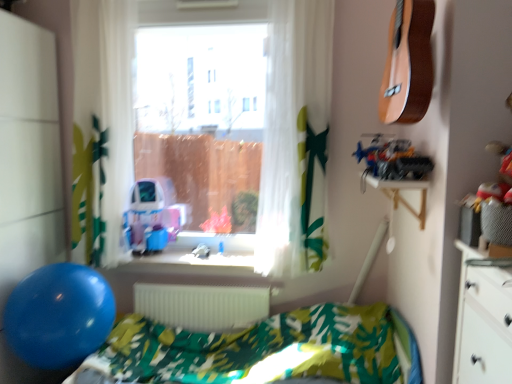
Measure the distance between white matte radiator at center and camera.

They are 2.76 meters apart.

Image resolution: width=512 pixels, height=384 pixels. Identify the location of metallic silver toy car at upper right. (392, 159).

Find the location of a particular element. The image size is (512, 384). white matte radiator at center is located at coordinates (202, 305).

Consider the image. Who is taller, green leaf-patterned fabric hospital bed at lower center or blue rubber balloon at lower left?

A: With more height is green leaf-patterned fabric hospital bed at lower center.

From a real-world perspective, is green leaf-patterned fabric hospital bed at lower center on top of blue rubber balloon at lower left?

Actually, green leaf-patterned fabric hospital bed at lower center is physically below blue rubber balloon at lower left in the real world.

Consider the image. Is green leaf-patterned fabric hospital bed at lower center directly adjacent to blue rubber balloon at lower left?

No, green leaf-patterned fabric hospital bed at lower center is not in contact with blue rubber balloon at lower left.

Looking at the image, does green leaf-patterned fabric hospital bed at lower center seem bigger or smaller compared to blue rubber balloon at lower left?

In the image, green leaf-patterned fabric hospital bed at lower center appears to be larger than blue rubber balloon at lower left.

From a real-world perspective, count 2nd curtains downward from the light brown wood guitar at upper right and point to it. Please provide its 2D coordinates.

[(295, 139)]

From the image's perspective, relative to light brown wood guitar at upper right, is translucent white curtain at center, the first curtain when ordered from right to left, above or below?

translucent white curtain at center, the first curtain when ordered from right to left, is situated lower than light brown wood guitar at upper right in the image.

Would you consider translucent white curtain at center, which is counted as the 2th curtain, starting from the left, to be distant from light brown wood guitar at upper right?

translucent white curtain at center, which is counted as the 2th curtain, starting from the left, is near light brown wood guitar at upper right, not far away.

Between light brown wood guitar at upper right and transparent glass window at center, which one appears on the left side from the viewer's perspective?

transparent glass window at center.

Based on their sizes in the image, would you say light brown wood guitar at upper right is bigger or smaller than transparent glass window at center?

Considering their sizes, light brown wood guitar at upper right takes up less space than transparent glass window at center.

From a real-world perspective, is light brown wood guitar at upper right below transparent glass window at center?

Actually, light brown wood guitar at upper right is physically above transparent glass window at center in the real world.

From the image's perspective, who appears lower, light brown wood guitar at upper right or transparent glass window at center?

transparent glass window at center is shown below in the image.

From the image's perspective, which object appears higher, light brown wood guitar at upper right or blue rubber balloon at lower left?

light brown wood guitar at upper right, from the image's perspective.

In the scene shown: Considering the relative sizes of light brown wood guitar at upper right and blue rubber balloon at lower left in the image provided, is light brown wood guitar at upper right wider than blue rubber balloon at lower left?

Incorrect, the width of light brown wood guitar at upper right does not surpass that of blue rubber balloon at lower left.

Is light brown wood guitar at upper right oriented towards blue rubber balloon at lower left?

No.

Considering the relative sizes of light brown wood guitar at upper right and blue rubber balloon at lower left in the image provided, is light brown wood guitar at upper right taller than blue rubber balloon at lower left?

In fact, light brown wood guitar at upper right may be shorter than blue rubber balloon at lower left.

Between green leaf-patterned fabric hospital bed at lower center and blue plastic toy at center, which one has less height?

blue plastic toy at center is shorter.

From a real-world perspective, is green leaf-patterned fabric hospital bed at lower center positioned under blue plastic toy at center based on gravity?

Yes.

How far apart are green leaf-patterned fabric hospital bed at lower center and blue plastic toy at center?

A distance of 34.32 inches exists between green leaf-patterned fabric hospital bed at lower center and blue plastic toy at center.

Between wooden shelf at upper right and white/sheer curtain at left, which ranks as the first curtain in left-to-right order, which one has smaller size?

wooden shelf at upper right is smaller.

Can you tell me how much wooden shelf at upper right and white/sheer curtain at left, the second curtain viewed from the right, differ in facing direction?

wooden shelf at upper right and white/sheer curtain at left, the second curtain viewed from the right, are facing 87.3 degrees away from each other.

Consider the image. Considering the sizes of wooden shelf at upper right and white/sheer curtain at left, which ranks as the first curtain in left-to-right order, in the image, is wooden shelf at upper right taller or shorter than white/sheer curtain at left, which ranks as the first curtain in left-to-right order,?

In the image, wooden shelf at upper right appears to be shorter than white/sheer curtain at left, which ranks as the first curtain in left-to-right order.

Is wooden shelf at upper right in contact with white/sheer curtain at left, which ranks as the first curtain in left-to-right order?

No, wooden shelf at upper right is not with white/sheer curtain at left, which ranks as the first curtain in left-to-right order.

From the image's perspective, relative to white matte radiator at center, is translucent white curtain at center, the first curtain when ordered from right to left, above or below?

From the image's perspective, translucent white curtain at center, the first curtain when ordered from right to left, appears above white matte radiator at center.

Is translucent white curtain at center, which is counted as the 2th curtain, starting from the left, at the left side of white matte radiator at center?

No.

Is translucent white curtain at center, the first curtain when ordered from right to left, turned away from white matte radiator at center?

That's not correct — translucent white curtain at center, the first curtain when ordered from right to left, is not looking away from white matte radiator at center.

At what (x,y) coordinates should I click in order to perform the action: click on radiator that is below the translucent white curtain at center, which is counted as the 2th curtain, starting from the left (from the image's perspective). Please return your answer as a coordinate pair (x, y). This screenshot has width=512, height=384. Looking at the image, I should click on (202, 305).

The width and height of the screenshot is (512, 384). In order to click on hospital bed that appears below the blue rubber balloon at lower left (from the image's perspective) in this screenshot , I will do `click(262, 350)`.

The width and height of the screenshot is (512, 384). Find the location of `guitar positioned vertically above the translucent white curtain at center, which is counted as the 2th curtain, starting from the left (from a real-world perspective)`. guitar positioned vertically above the translucent white curtain at center, which is counted as the 2th curtain, starting from the left (from a real-world perspective) is located at coordinates (408, 64).

In the scene shown: Based on their spatial positions, is white/sheer curtain at left, which ranks as the first curtain in left-to-right order, or metallic silver toy car at upper right closer to wooden shelf at upper right?

metallic silver toy car at upper right.

Considering their positions, is wooden shelf at upper right positioned further to blue rubber balloon at lower left than blue plastic toy at center?

Among the two, wooden shelf at upper right is located further to blue rubber balloon at lower left.

Based on their spatial positions, is wooden shelf at upper right or translucent white curtain at center, which is counted as the 2th curtain, starting from the left, closer to blue rubber balloon at lower left?

translucent white curtain at center, which is counted as the 2th curtain, starting from the left.

Looking at the image, which one is located further to green leaf-patterned fabric hospital bed at lower center, white matte radiator at center or translucent white curtain at center, the first curtain when ordered from right to left?

translucent white curtain at center, the first curtain when ordered from right to left.

From the image, which object appears to be farther from green leaf-patterned fabric hospital bed at lower center, blue rubber balloon at lower left or blue plastic toy at center?

Among the two, blue plastic toy at center is located further to green leaf-patterned fabric hospital bed at lower center.

Looking at this image, when comparing their distances from white matte radiator at center, does blue rubber balloon at lower left or blue plastic toy at center seem closer?

blue plastic toy at center lies closer to white matte radiator at center than the other object.

When comparing their distances from translucent white curtain at center, which is counted as the 2th curtain, starting from the left, does light brown wood guitar at upper right or blue rubber balloon at lower left seem further?

blue rubber balloon at lower left lies further to translucent white curtain at center, which is counted as the 2th curtain, starting from the left, than the other object.

Looking at the image, which one is located further to white matte radiator at center, blue plastic toy at center or translucent white curtain at center, the first curtain when ordered from right to left?

Among the two, translucent white curtain at center, the first curtain when ordered from right to left, is located further to white matte radiator at center.

Identify the location of window between blue rubber balloon at lower left and metallic silver toy car at upper right. Image resolution: width=512 pixels, height=384 pixels. tap(295, 138).

At what (x,y) coordinates should I click in order to perform the action: click on window located between light brown wood guitar at upper right and blue plastic toy at center in the depth direction. Please return your answer as a coordinate pair (x, y). Image resolution: width=512 pixels, height=384 pixels. Looking at the image, I should click on (295, 138).

Identify the location of radiator located between blue rubber balloon at lower left and wooden shelf at upper right in the left-right direction. The width and height of the screenshot is (512, 384). (202, 305).

Image resolution: width=512 pixels, height=384 pixels. What are the coordinates of `radiator between white/sheer curtain at left, the second curtain viewed from the right, and light brown wood guitar at upper right from left to right` in the screenshot? It's located at (202, 305).